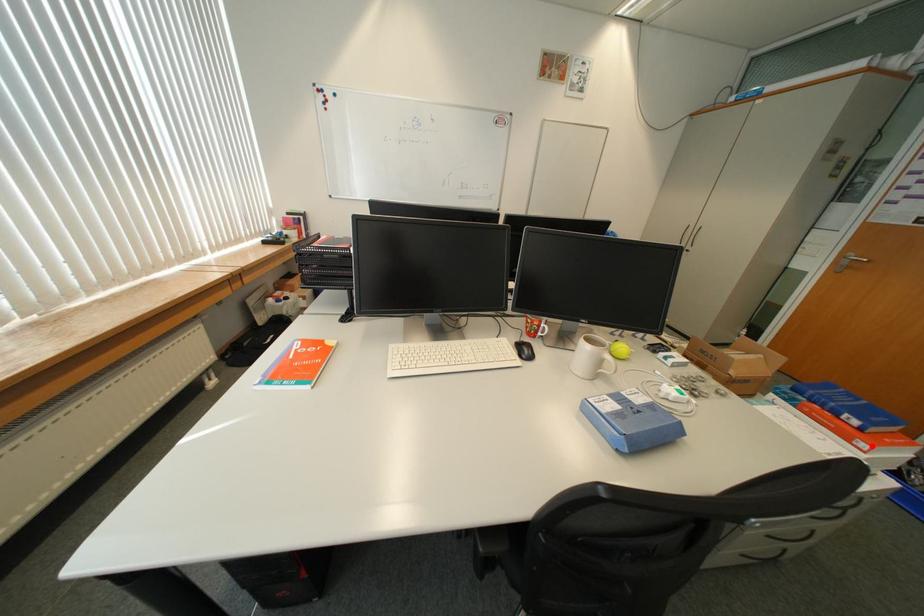
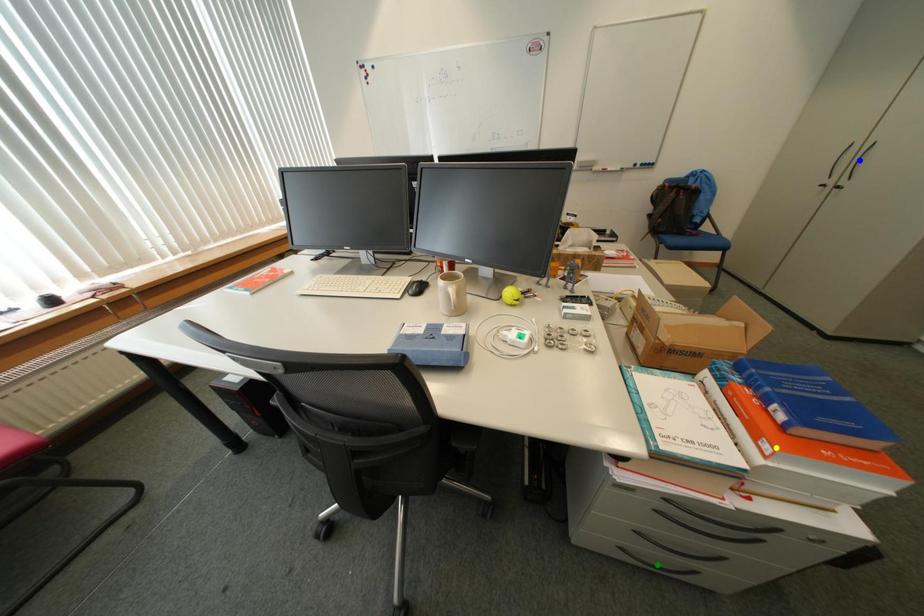
Question: I am providing you with two images of the same scene from different viewpoints. A red point is marked on the first image. You are given multiple points on the second image. Which point in image 2 is actually the same real-world point as the red point in image 1?

Choices:
 (A) blue point
 (B) green point
 (C) yellow point

Answer: (C)